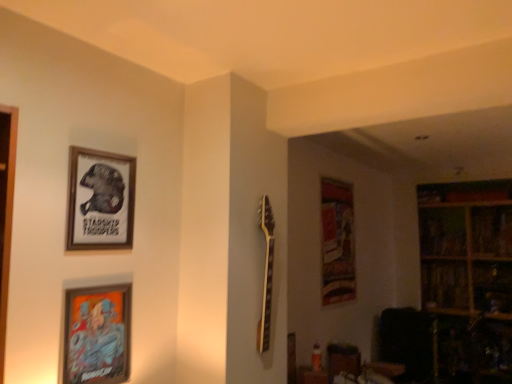
Question: Is wooden framed poster at upper left, which ranks as the first picture frame in top-to-bottom order, oriented towards wooden bookshelf at upper right, which is the 1th shelf in top-to-bottom order?

Choices:
 (A) yes
 (B) no

Answer: (B)

Question: Is wooden framed poster at upper left, which is the 2th picture frame from bottom to top, smaller than wooden bookshelf at upper right, which is the 1th shelf in top-to-bottom order?

Choices:
 (A) yes
 (B) no

Answer: (A)

Question: Is wooden framed poster at upper left, which is the 2th picture frame from bottom to top, oriented away from wooden bookshelf at upper right, the 2th shelf in the bottom-to-top sequence?

Choices:
 (A) yes
 (B) no

Answer: (B)

Question: Does wooden framed poster at upper left, which ranks as the first picture frame in top-to-bottom order, have a lesser width compared to wooden bookshelf at upper right, the 2th shelf in the bottom-to-top sequence?

Choices:
 (A) yes
 (B) no

Answer: (A)

Question: Does wooden framed poster at upper left, which ranks as the first picture frame in top-to-bottom order, have a lesser height compared to wooden bookshelf at upper right, which is the 1th shelf in top-to-bottom order?

Choices:
 (A) yes
 (B) no

Answer: (A)

Question: From a real-world perspective, relative to metallic silver picture frame at lower left, positioned as the 2th picture frame in top-to-bottom order, is wooden framed poster at upper left, which is the 2th picture frame from bottom to top, vertically above or below?

Choices:
 (A) below
 (B) above

Answer: (B)

Question: Considering the positions of point (86, 183) and point (82, 336), is point (86, 183) closer or farther from the camera than point (82, 336)?

Choices:
 (A) farther
 (B) closer

Answer: (A)

Question: Considering the positions of wooden framed poster at upper left, which is the 2th picture frame from bottom to top, and metallic silver picture frame at lower left, positioned as the 2th picture frame in top-to-bottom order, in the image, is wooden framed poster at upper left, which is the 2th picture frame from bottom to top, taller or shorter than metallic silver picture frame at lower left, positioned as the 2th picture frame in top-to-bottom order,?

Choices:
 (A) tall
 (B) short

Answer: (A)

Question: Considering the positions of wooden framed poster at upper left, which is the 2th picture frame from bottom to top, and metallic silver picture frame at lower left, positioned as the 1th picture frame in bottom-to-top order, in the image, is wooden framed poster at upper left, which is the 2th picture frame from bottom to top, wider or thinner than metallic silver picture frame at lower left, positioned as the 1th picture frame in bottom-to-top order,?

Choices:
 (A) thin
 (B) wide

Answer: (B)

Question: In the image, is wooden framed poster at upper left, which is the 2th picture frame from bottom to top, on the left side or the right side of wooden bookshelf at upper right, which is the 1th shelf in top-to-bottom order?

Choices:
 (A) left
 (B) right

Answer: (A)

Question: From the image's perspective, relative to wooden bookshelf at upper right, the 2th shelf in the bottom-to-top sequence, is wooden framed poster at upper left, which ranks as the first picture frame in top-to-bottom order, above or below?

Choices:
 (A) below
 (B) above

Answer: (B)

Question: Is point (75, 201) closer or farther from the camera than point (449, 238)?

Choices:
 (A) closer
 (B) farther

Answer: (A)

Question: From a real-world perspective, is wooden framed poster at upper left, which is the 2th picture frame from bottom to top, positioned above or below wooden bookshelf at upper right, the 2th shelf in the bottom-to-top sequence?

Choices:
 (A) above
 (B) below

Answer: (A)

Question: In terms of width, does metallic silver picture frame at lower left, positioned as the 2th picture frame in top-to-bottom order, look wider or thinner when compared to wooden bookshelf at right, the first shelf in the bottom-to-top sequence?

Choices:
 (A) thin
 (B) wide

Answer: (A)

Question: From the image's perspective, relative to wooden bookshelf at right, the first shelf in the bottom-to-top sequence, is metallic silver picture frame at lower left, positioned as the 2th picture frame in top-to-bottom order, above or below?

Choices:
 (A) below
 (B) above

Answer: (B)